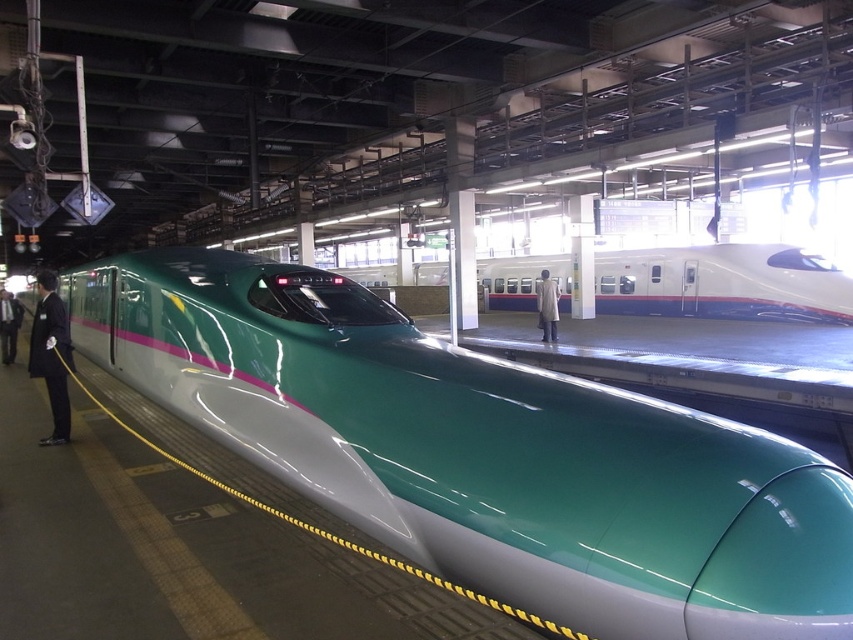
You are a passenger waiting on the platform and see the teal glossy train at center and the black suit at left. Which object is shorter in height?

The teal glossy train at center is not as tall as the black suit at left, so the teal glossy train at center is shorter in height.

You are a passenger waiting at the teal glossy train at center and dark suit at left. Which object is larger in size?

The teal glossy train at center is bigger than the dark suit at left.